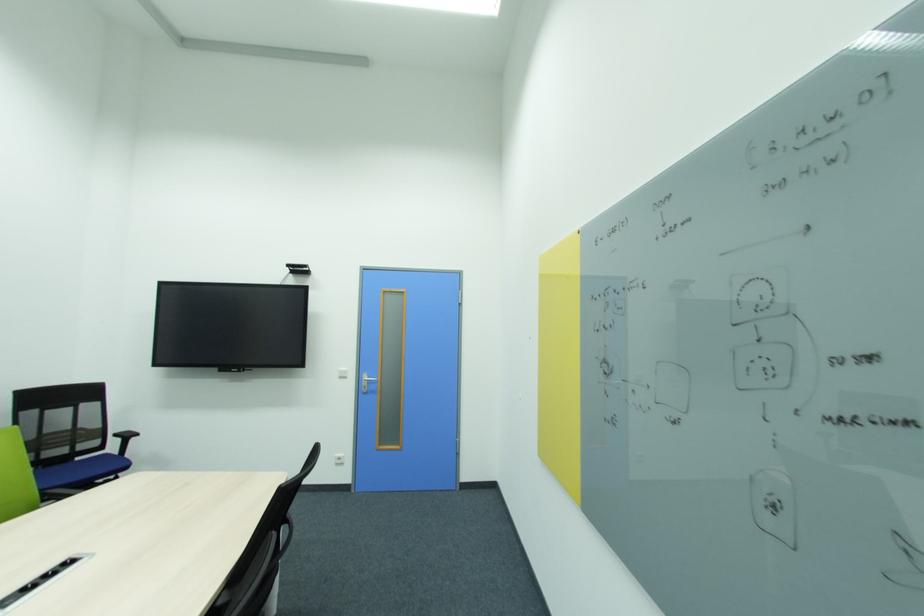
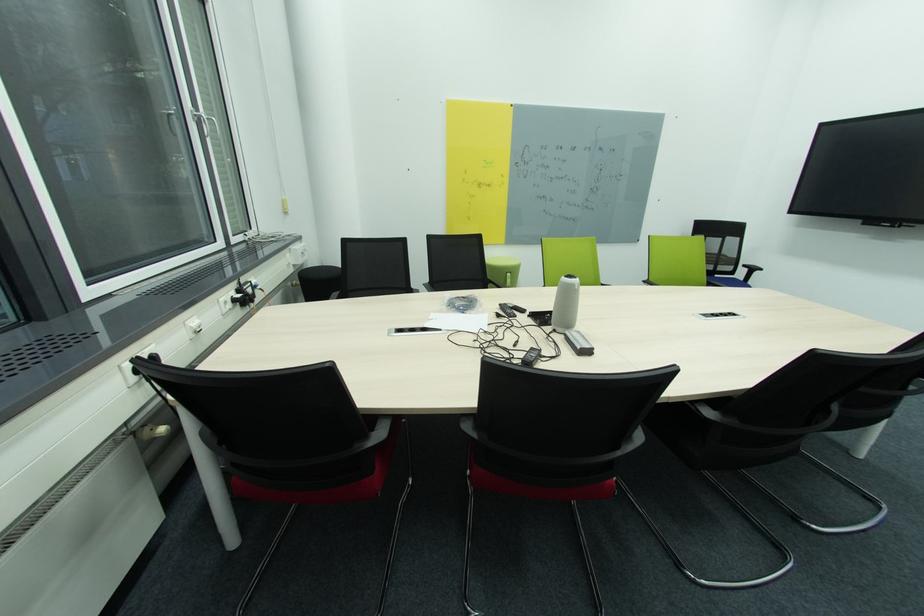
Find the pixel in the second image that matches the point at 120,436 in the first image.

(749, 267)